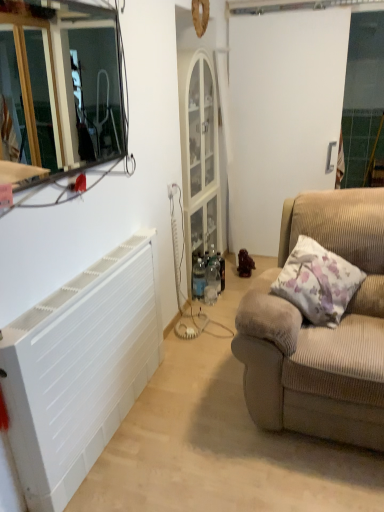
Locate an element on the screen. Image resolution: width=384 pixels, height=512 pixels. vacant space positioned to the left of brown matte figurine at center-right is located at coordinates (230, 276).